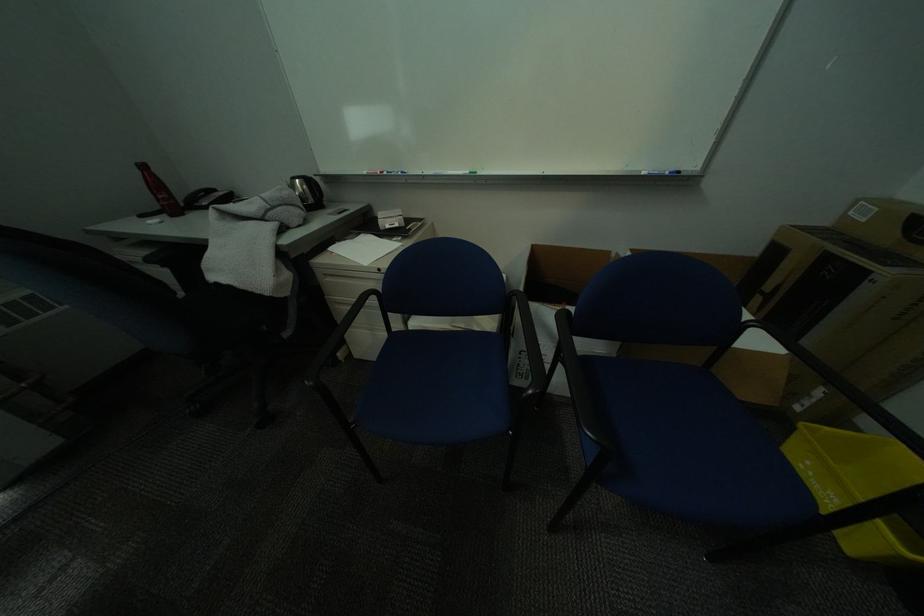
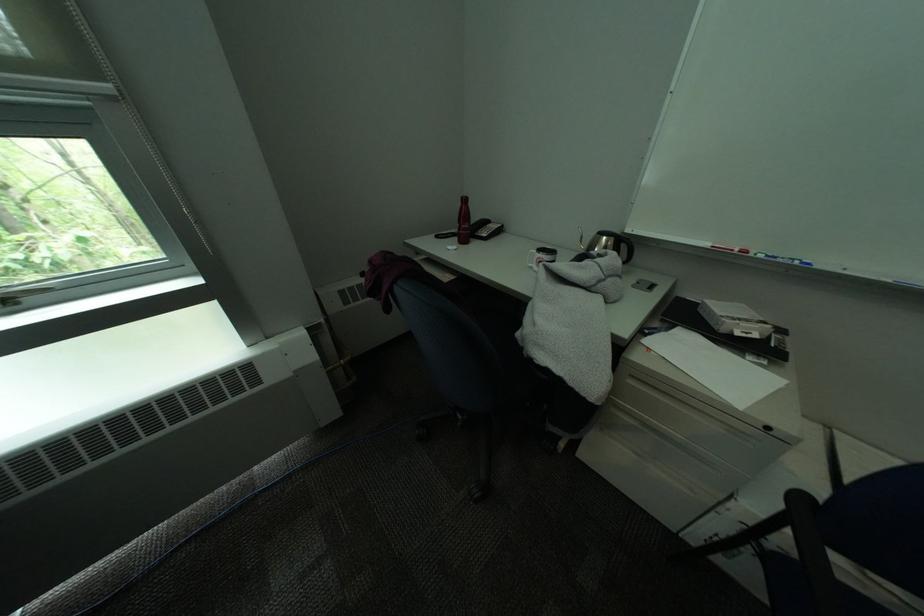
Find the pixel in the second image that matches (x=300, y=294) in the first image.

(615, 402)